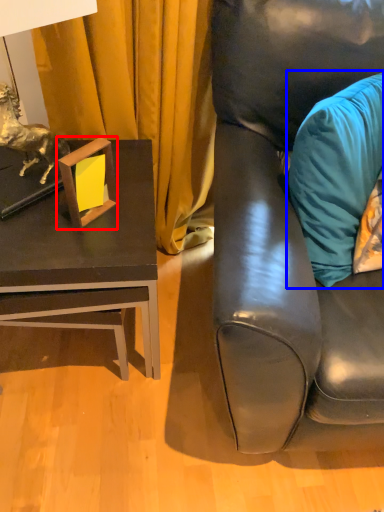
Question: Which object is further to the camera taking this photo, picture frame (highlighted by a red box) or pillow (highlighted by a blue box)?

Choices:
 (A) picture frame
 (B) pillow

Answer: (A)